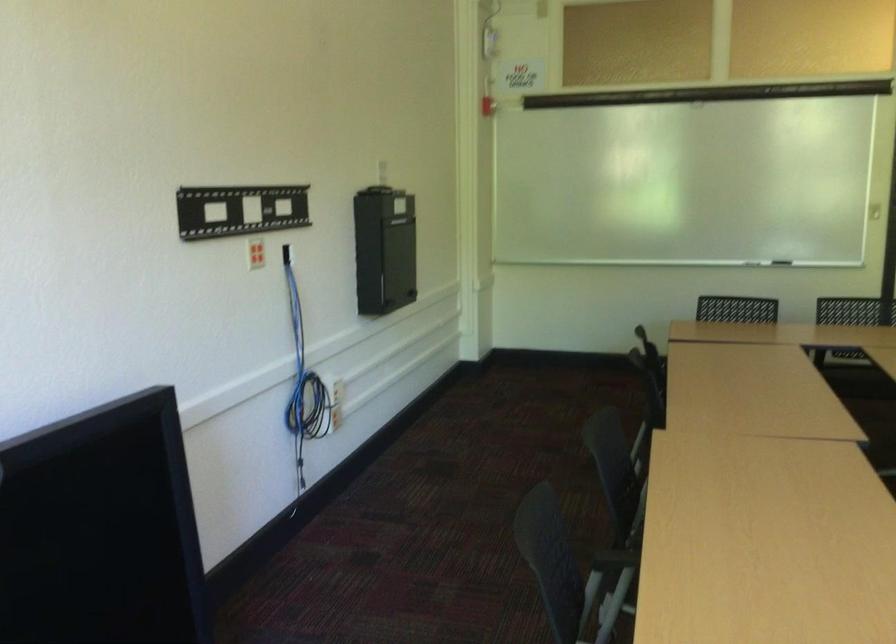
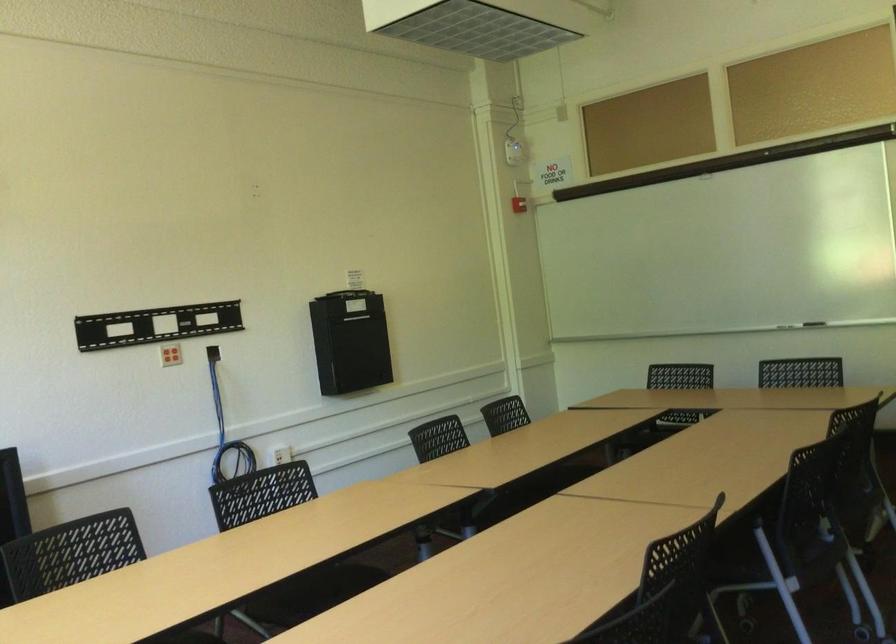
In the second image, find the point that corresponds to (304,361) in the first image.

(226, 431)